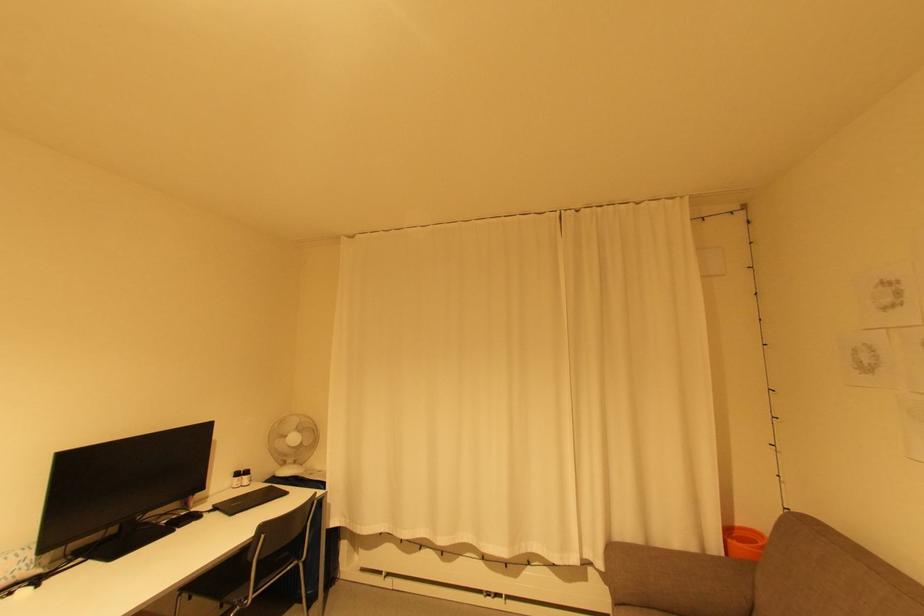
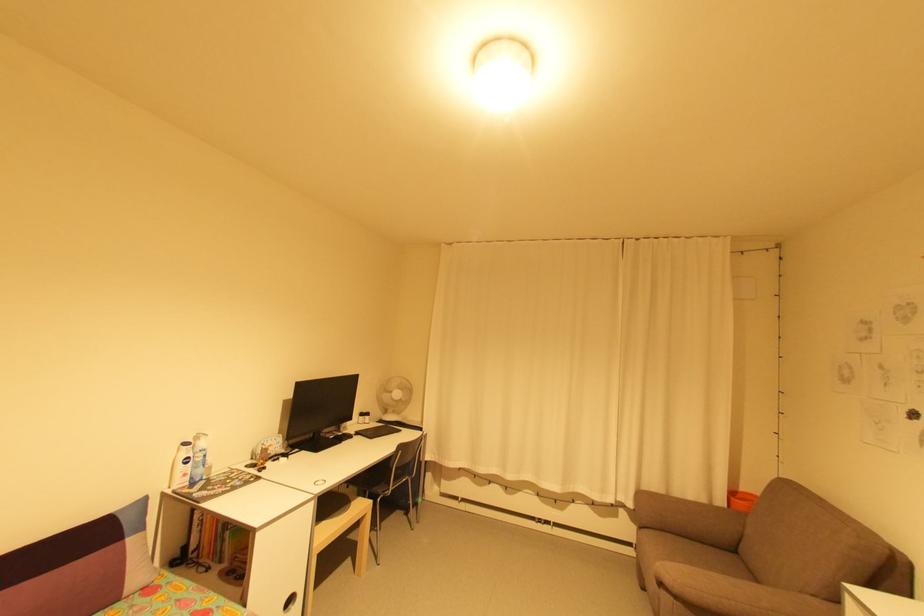
Question: The camera is either moving clockwise (left) or counter-clockwise (right) around the object. The first image is from the beginning of the video and the second image is from the end. Is the camera moving left or right when shooting the video?

Choices:
 (A) Left
 (B) Right

Answer: (B)